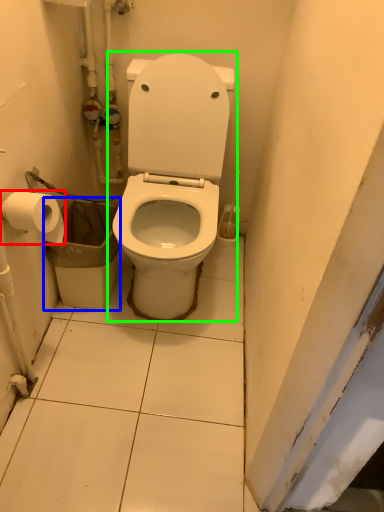
Question: Which object is the farthest from toilet paper (highlighted by a red box)? Choose among these: garbage (highlighted by a blue box) or toilet (highlighted by a green box).

Choices:
 (A) garbage
 (B) toilet

Answer: (B)